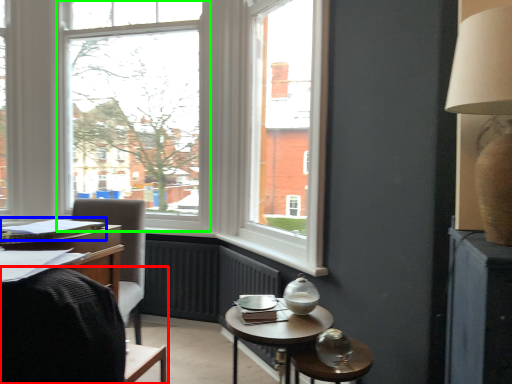
Question: Which object is positioned closest to chair (highlighted by a red box)? Select from book (highlighted by a blue box) and window (highlighted by a green box).

Choices:
 (A) book
 (B) window

Answer: (A)